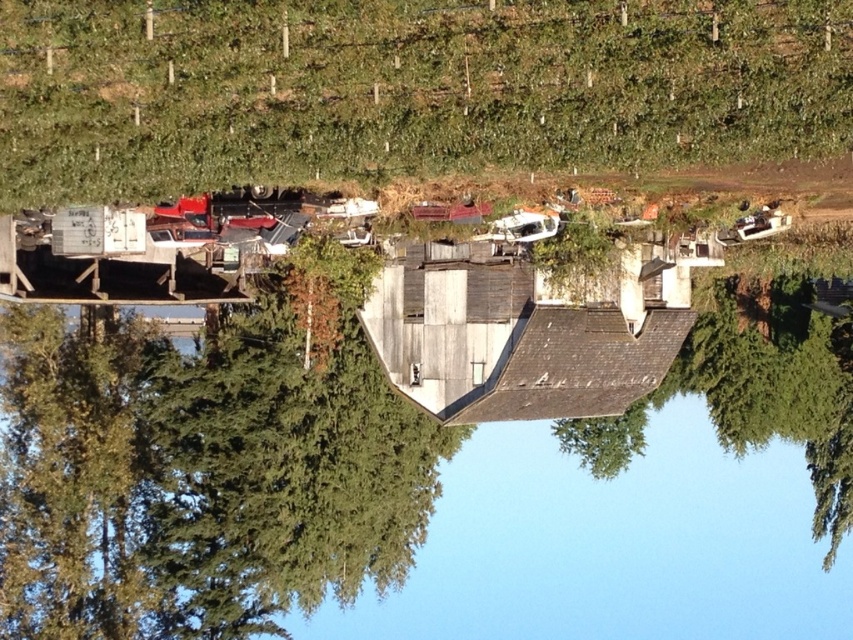
Based on the photo, you are standing at the origin point of the coordinate system in the image. The weathered wood hut at center is located at point [517,336]. If you want to move towards the weathered wood hut at center, in which direction should you move?

You should move towards the point [517,336] to reach the weathered wood hut at center.

You are standing in the field and want to take a photo of both the green leafy hillside at upper center and the weathered wood hut at center. Which object should you position to the left side of the other to capture both in the frame?

To capture both the green leafy hillside at upper center and the weathered wood hut at center in the frame, position the green leafy hillside at upper center to the left side of the weathered wood hut at center.

You are standing in the field looking at the green leafy hillside at upper center and the weathered wood hut at center. Which object is higher up in the image?

The green leafy hillside at upper center is higher up in the image than the weathered wood hut at center.